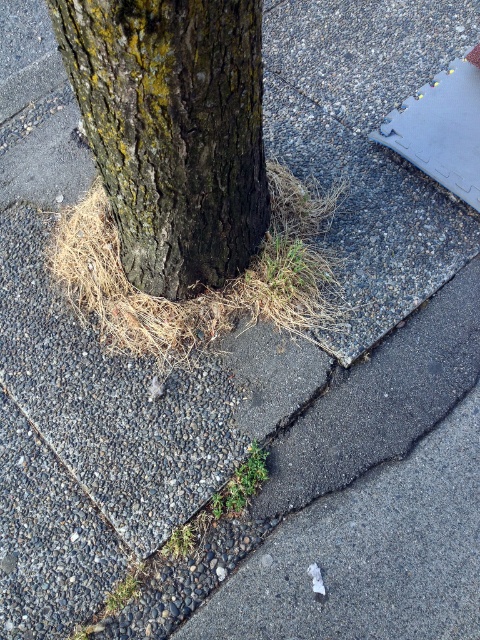
Question: Considering the real-world distances, which object is farthest from the dark brown rough bark at center?

Choices:
 (A) brown dry grass at center
 (B) green grassy weed at lower center

Answer: (B)

Question: Can you confirm if brown dry grass at center is wider than green grassy weed at lower center?

Choices:
 (A) yes
 (B) no

Answer: (A)

Question: Which of these objects is positioned farthest from the brown dry grass at center?

Choices:
 (A) green grassy weed at lower center
 (B) dark brown rough bark at center

Answer: (A)

Question: Does dark brown rough bark at center have a smaller size compared to green grassy weed at lower center?

Choices:
 (A) yes
 (B) no

Answer: (B)

Question: Is dark brown rough bark at center above green grassy weed at lower center?

Choices:
 (A) no
 (B) yes

Answer: (B)

Question: Which point is farther to the camera?

Choices:
 (A) dark brown rough bark at center
 (B) green grassy weed at lower center
 (C) brown dry grass at center

Answer: (C)